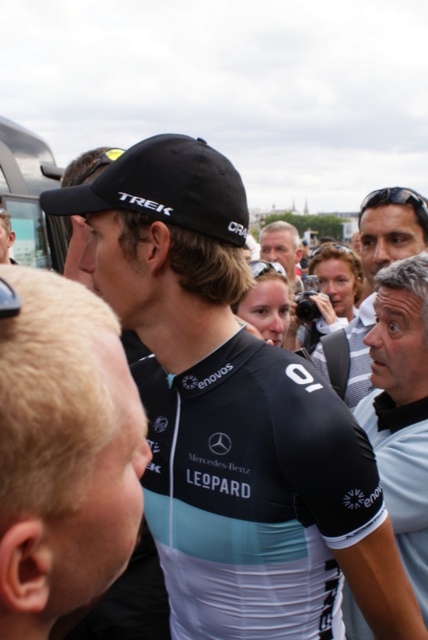
You are a photographer at the event and want to capture the cyclist wearing the black jersey at center and the person with light brown hair at center in the same frame. Based on their positions, which one is closer to the bottom of the image?

The black jersey at center is located below light brown hair at center, so the black jersey at center is closer to the bottom of the image.

You are standing at the point marked by coordinates [232,417] in the image. What object is located at this point?

The point marked by coordinates [232,417] is located at the black matte jersey at center.

You are standing in the crowd at this event and want to take a photo of the central figure wearing the black cycling jersey with the number 01 on the back. There are two points marked in the image at coordinates point (425, 216) and point (285, 227). Which point would give you a better view of the central figure?

Point (425, 216) is closer to the camera than point (285, 227), so it would provide a better view of the central figure.